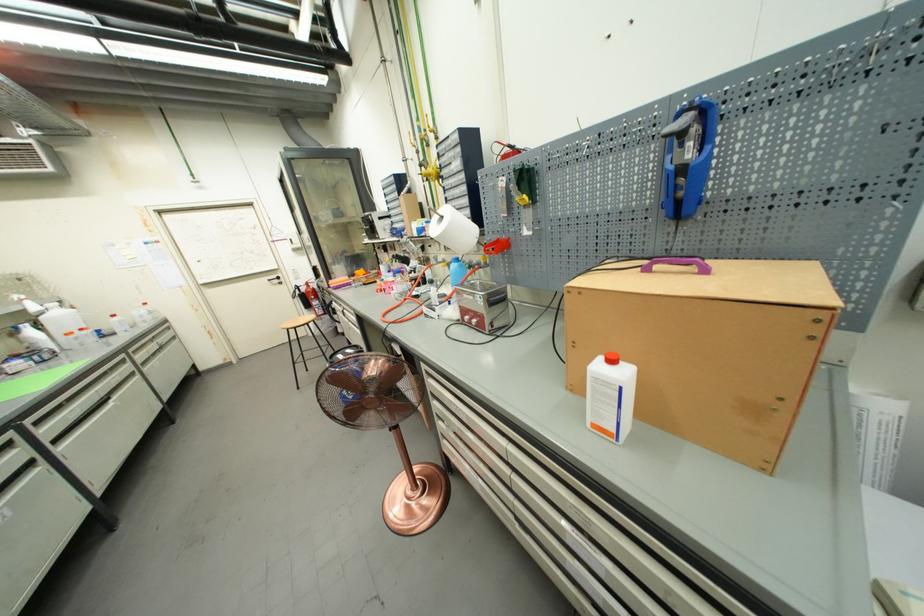
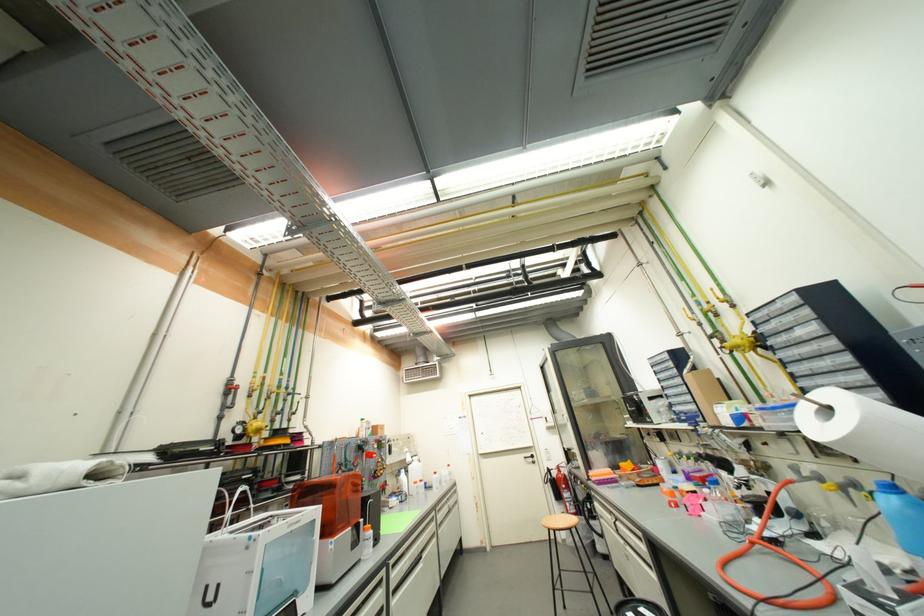
The point at (146, 363) is marked in the first image. Where is the corresponding point in the second image?

(444, 525)